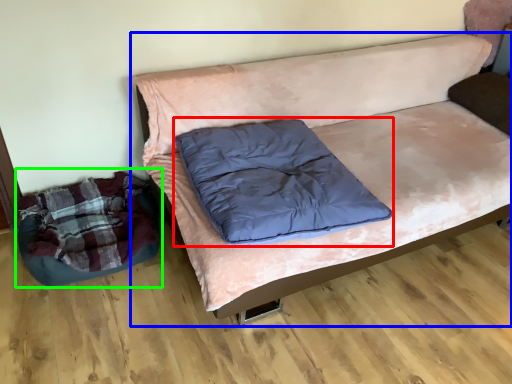
Question: Which object is the closest to the pillow (highlighted by a red box)? Choose among these: studio couch (highlighted by a blue box) or bean bag chair (highlighted by a green box).

Choices:
 (A) studio couch
 (B) bean bag chair

Answer: (A)